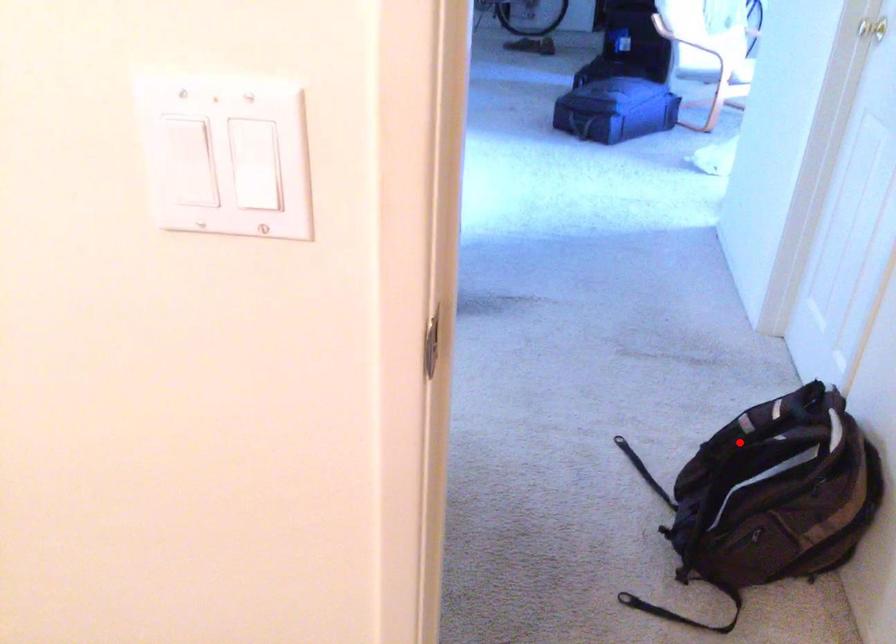
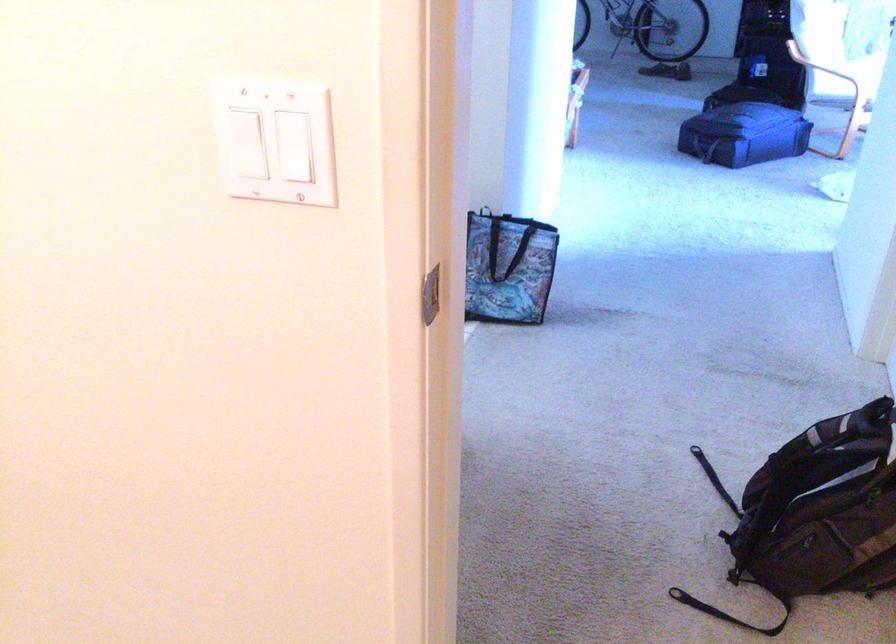
Find the pixel in the second image that matches the highlighted location in the first image.

(805, 446)